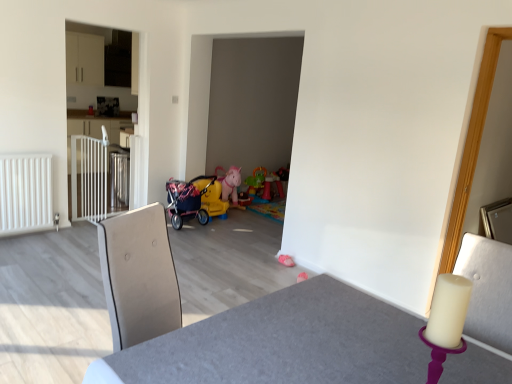
The height and width of the screenshot is (384, 512). I want to click on vacant area on top of white matte radiator at left (from a real-world perspective), so click(x=17, y=151).